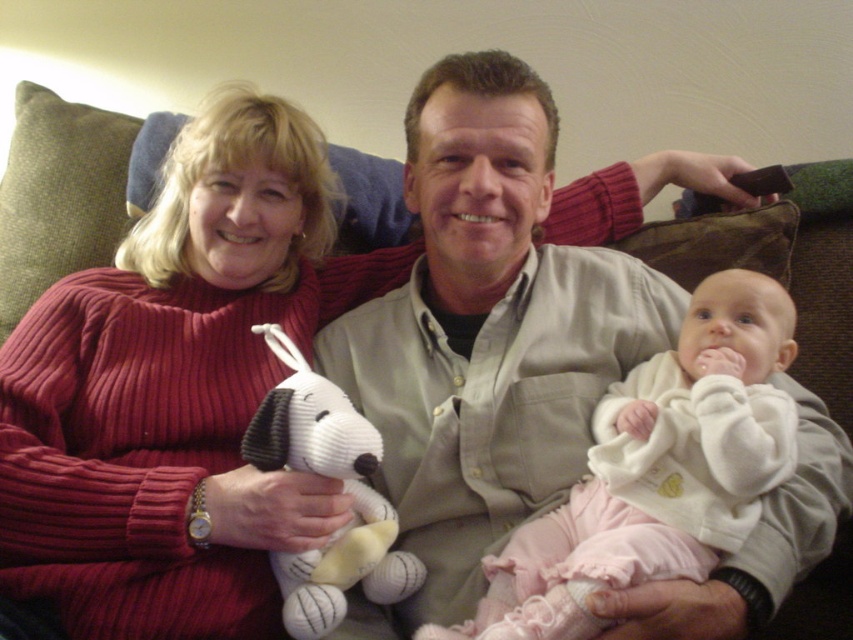
Can you confirm if matte khaki shirt at center is bigger than white knitted dog at center?

Indeed, matte khaki shirt at center has a larger size compared to white knitted dog at center.

This screenshot has height=640, width=853. I want to click on matte khaki shirt at center, so click(485, 337).

Does point (511, 381) lie behind point (303, 579)?

Yes, it is behind point (303, 579).

You are a GUI agent. You are given a task and a screenshot of the screen. Output one action in this format:
    pyautogui.click(x=<x>, y=<y>)
    Task: Click on the matte khaki shirt at center
    
    Given the screenshot: What is the action you would take?
    pyautogui.click(x=485, y=337)

Does white fleece jacket at center have a greater width compared to white knitted dog at center?

Correct, the width of white fleece jacket at center exceeds that of white knitted dog at center.

Is white fleece jacket at center thinner than white knitted dog at center?

No.

Image resolution: width=853 pixels, height=640 pixels. I want to click on white fleece jacket at center, so click(x=659, y=470).

This screenshot has width=853, height=640. What are the coordinates of `white fleece jacket at center` in the screenshot? It's located at (659, 470).

Does point (491, 97) lie in front of point (677, 576)?

That is False.

This screenshot has width=853, height=640. I want to click on matte khaki shirt at center, so click(x=485, y=337).

Image resolution: width=853 pixels, height=640 pixels. I want to click on matte khaki shirt at center, so click(x=485, y=337).